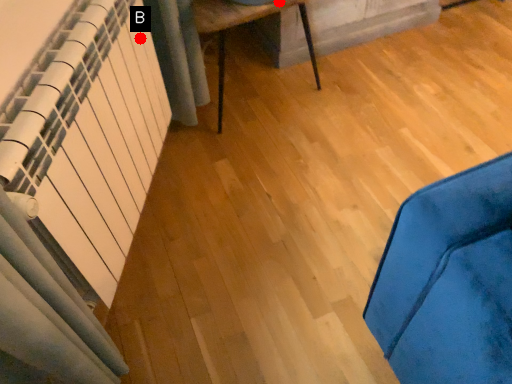
Question: Two points are circled on the image, labeled by A and B beside each circle. Among these points, which one is farthest from the camera?

Choices:
 (A) A is further
 (B) B is further

Answer: (A)